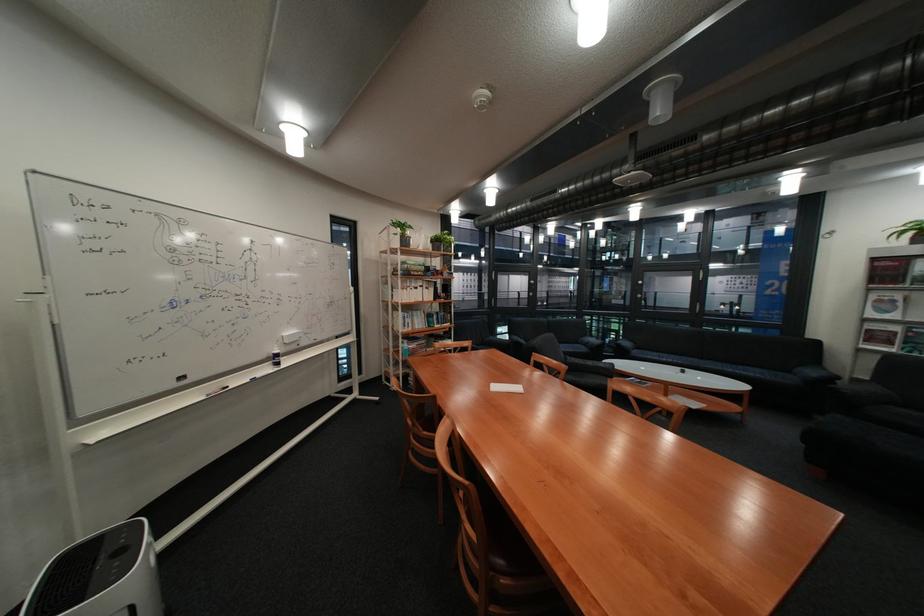
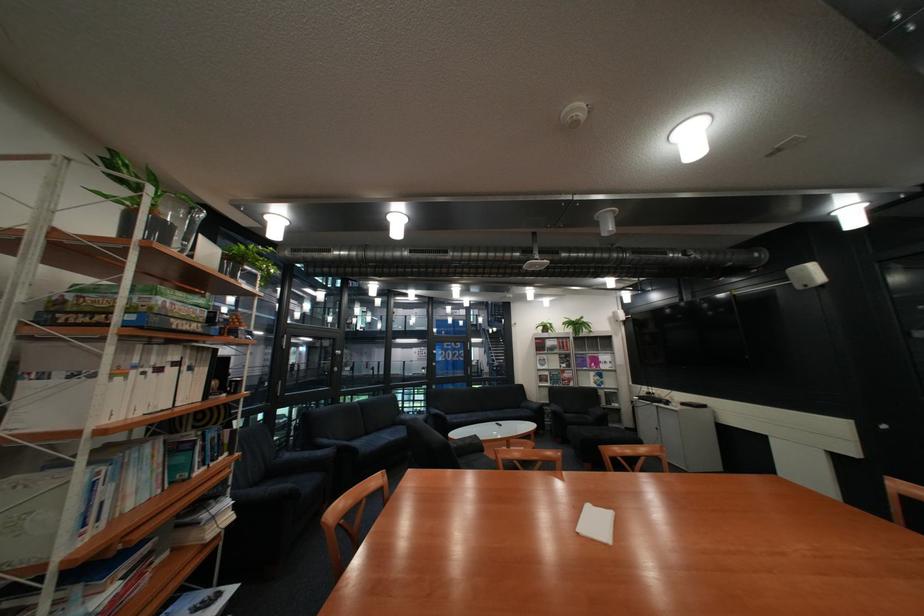
In the second image, find the point that corresponds to [805,371] in the first image.

(535, 408)